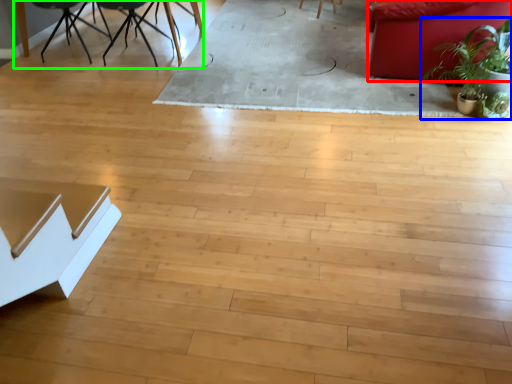
Question: Which is nearer to the couch (highlighted by a red box)? houseplant (highlighted by a blue box) or round table (highlighted by a green box).

Choices:
 (A) houseplant
 (B) round table

Answer: (A)